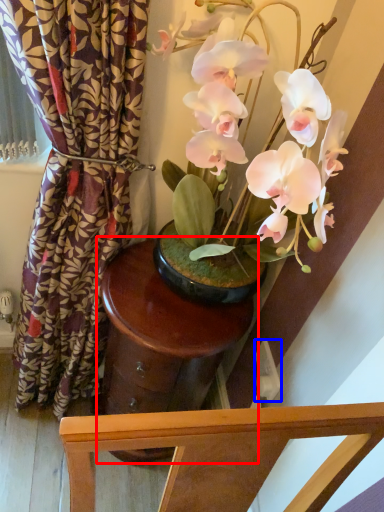
Question: Which of the following is the closest to the observer, round table (highlighted by a red box) or power outlet (highlighted by a blue box)?

Choices:
 (A) round table
 (B) power outlet

Answer: (A)